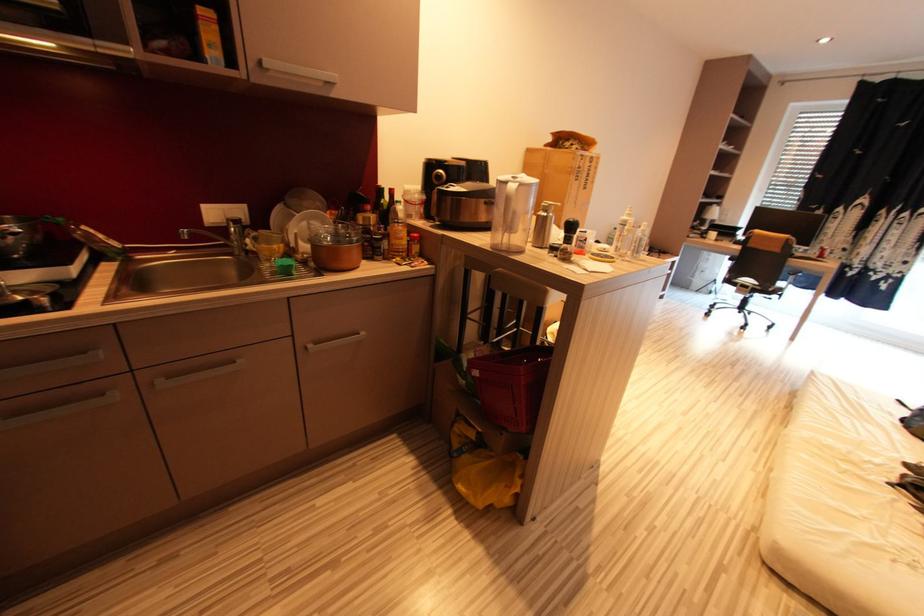
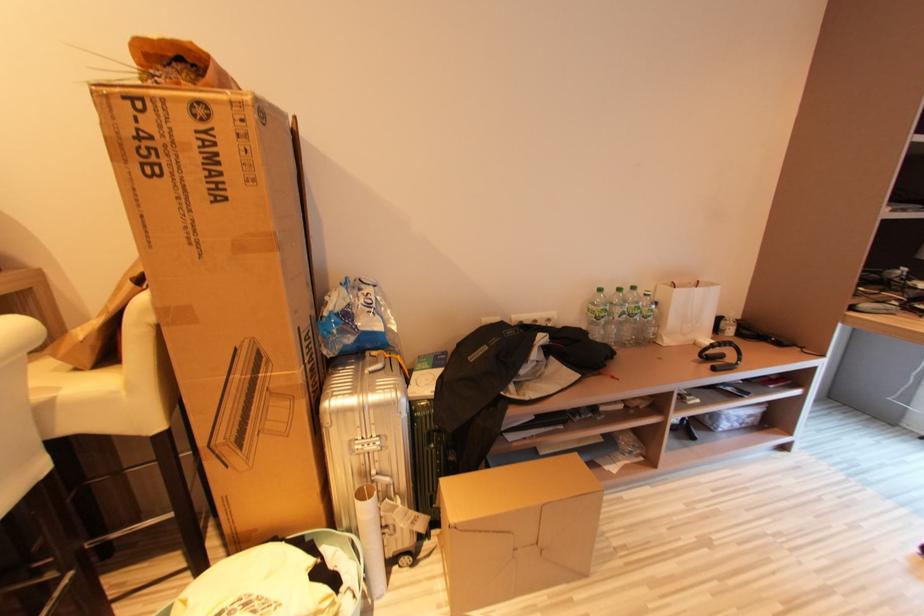
The images are taken continuously from a first-person perspective. In which direction are you moving?

The movement direction of the cameraman is right, forward.